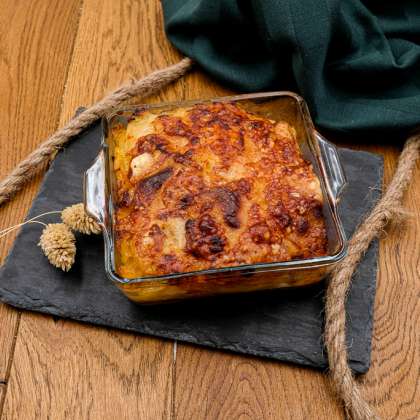
Locate an element on the screen. decore is located at coordinates (61, 244), (71, 217).